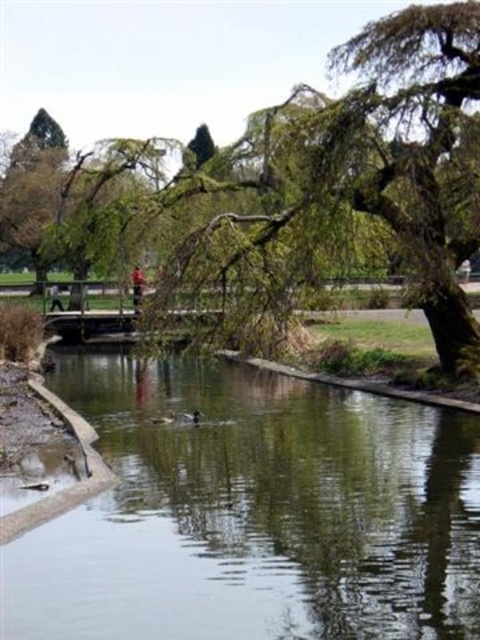
In the scene shown: You are standing on the wooden bridge in the park scene. Looking down, you see the clear water at center and the green leafy tree at center. Which object is closer to your feet?

The clear water at center is below the green leafy tree at center, so the clear water at center is closer to your feet.

What is the exact location of the clear water at center in the park scene?

The clear water at center is located at point coordinates of (253, 513).